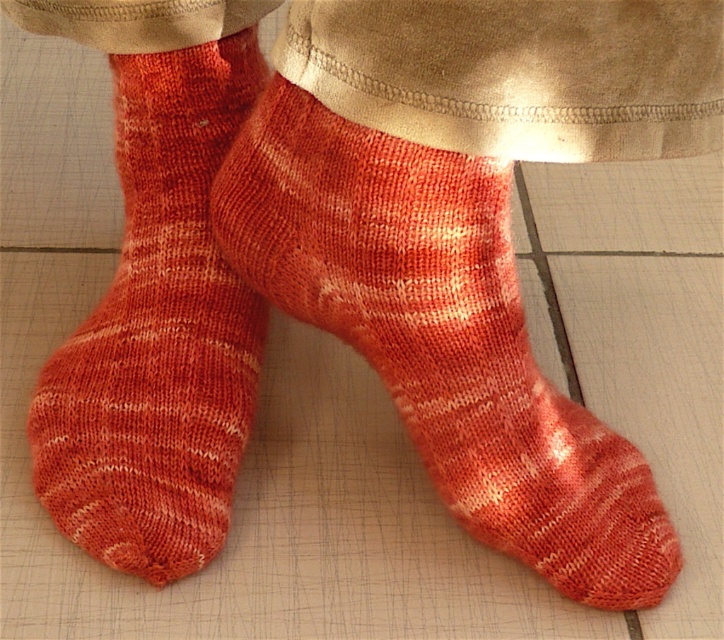
Can you confirm if knitted woolen sock at center is thinner than knitted orange socks at center?

No, knitted woolen sock at center is not thinner than knitted orange socks at center.

Who is taller, knitted woolen sock at center or knitted orange socks at center?

Standing taller between the two is knitted orange socks at center.

Which is in front, point (450, 193) or point (164, 408)?

Point (450, 193) is more forward.

Find the location of a particular element. knitted woolen sock at center is located at coordinates tap(441, 337).